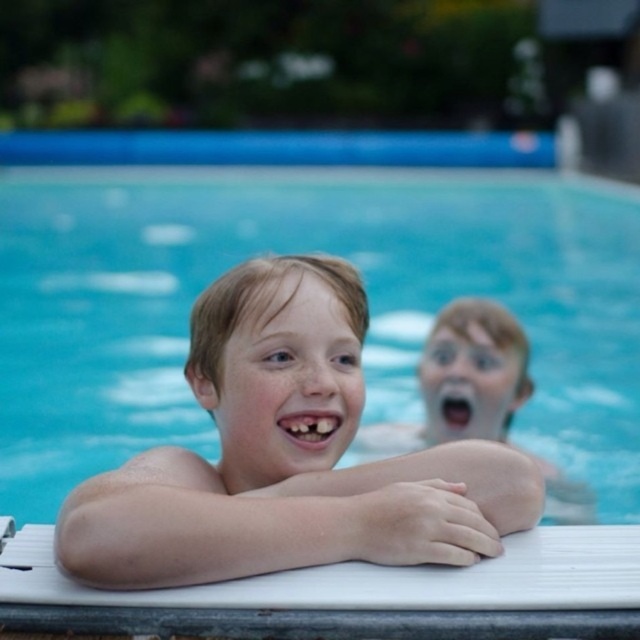
Who is shorter, smooth skin boy at center or smooth skin child at center?

smooth skin boy at center

Between smooth skin boy at center and smooth skin child at center, which one is positioned lower?

smooth skin child at center is below.

Between point (80, 548) and point (460, 324), which one is positioned behind?

The point (460, 324) is more distant.

Locate an element on the screen. smooth skin boy at center is located at coordinates (285, 456).